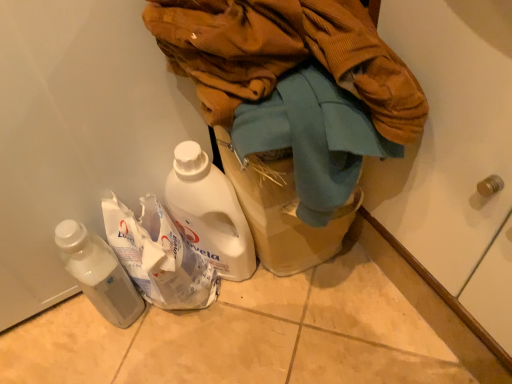
The height and width of the screenshot is (384, 512). Describe the element at coordinates (98, 273) in the screenshot. I see `translucent plastic bottle at lower left` at that location.

Find the location of a particular element. translucent plastic bottle at lower left is located at coordinates (98, 273).

In order to face translucent plastic bottle at lower left, should I rotate leftwards or rightwards?

A 20.760 degree turn to the left will do.

At what (x,y) coordinates should I click in order to perform the action: click on translucent plastic bottle at lower left. Please return your answer as a coordinate pair (x, y). The image size is (512, 384). Looking at the image, I should click on (98, 273).